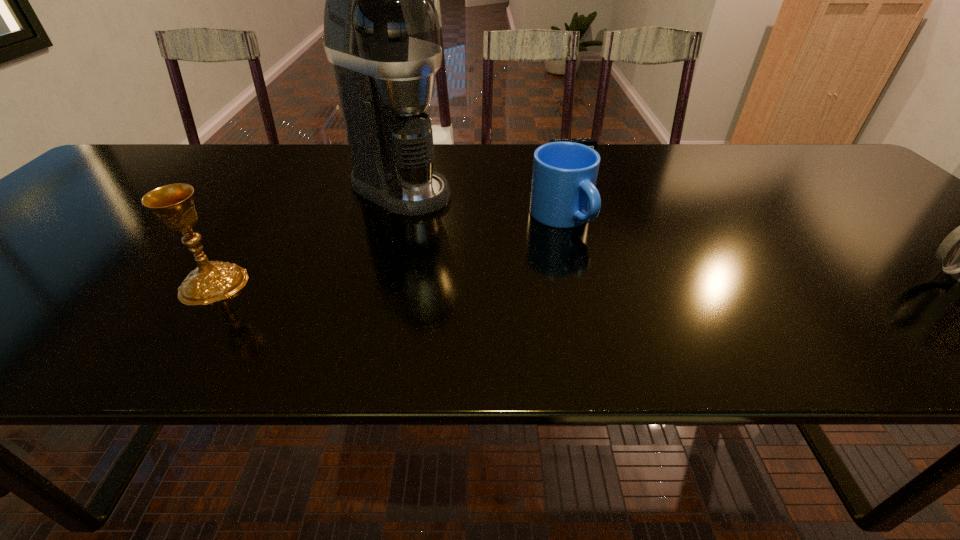
This screenshot has width=960, height=540. I want to click on blank area at the near edge, so click(x=550, y=309).

In the image, there is a desktop. Identify the location of vacant space at the left edge. (133, 192).

This screenshot has width=960, height=540. I want to click on vacant area at the right edge of the desktop, so click(872, 194).

Locate an element on the screen. The image size is (960, 540). vacant space at the far right corner of the desktop is located at coordinates (776, 144).

Where is `unoccupied position between the leftmost object and the tallest object`? This screenshot has height=540, width=960. unoccupied position between the leftmost object and the tallest object is located at coordinates (307, 236).

Where is `vacant area between the shortest object and the tallest object`? vacant area between the shortest object and the tallest object is located at coordinates (485, 175).

You are a GUI agent. You are given a task and a screenshot of the screen. Output one action in this format:
    pyautogui.click(x=<x>, y=<y>)
    Task: Click on the empty location between the fourth shortest object and the left mug
    This screenshot has width=960, height=540.
    Given the screenshot: What is the action you would take?
    pyautogui.click(x=388, y=251)

Find the location of a particular element. The height and width of the screenshot is (540, 960). unoccupied area between the tallest object and the alarm clock is located at coordinates (485, 175).

At what (x,y) coordinates should I click in order to perform the action: click on free spot between the tallest object and the left mug. Please return your answer as a coordinate pair (x, y). Looking at the image, I should click on (480, 202).

Identify which object is the second closest to the nearer mug. Please provide its 2D coordinates. Your answer should be formatted as a tuple, i.e. [(x, y)], where the tuple contains the x and y coordinates of a point satisfying the conditions above.

[(591, 142)]